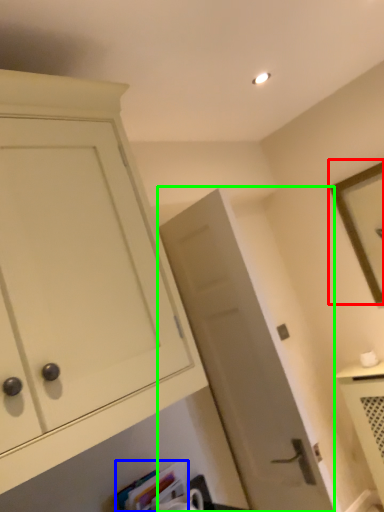
Question: Which is farther away from picture frame (highlighted by a red box)? book (highlighted by a blue box) or door (highlighted by a green box)?

Choices:
 (A) book
 (B) door

Answer: (A)